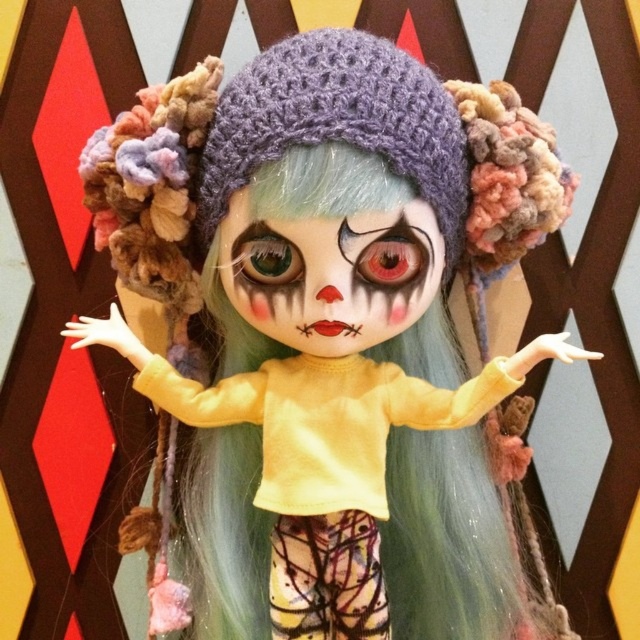
You are a fashion designer observing the doll. You need to determine if the purple knitted hat at center will cover the matte painted face at center when worn. Based on the doll, can you tell if the hat will cover the face?

The purple knitted hat at center is taller than the matte painted face at center, so the hat will cover the face when worn.

Based on the description, can you determine if the purple knitted hat at center is wider than the matte painted face at center?

The purple knitted hat at center might be wider than matte painted face at center according to the description.